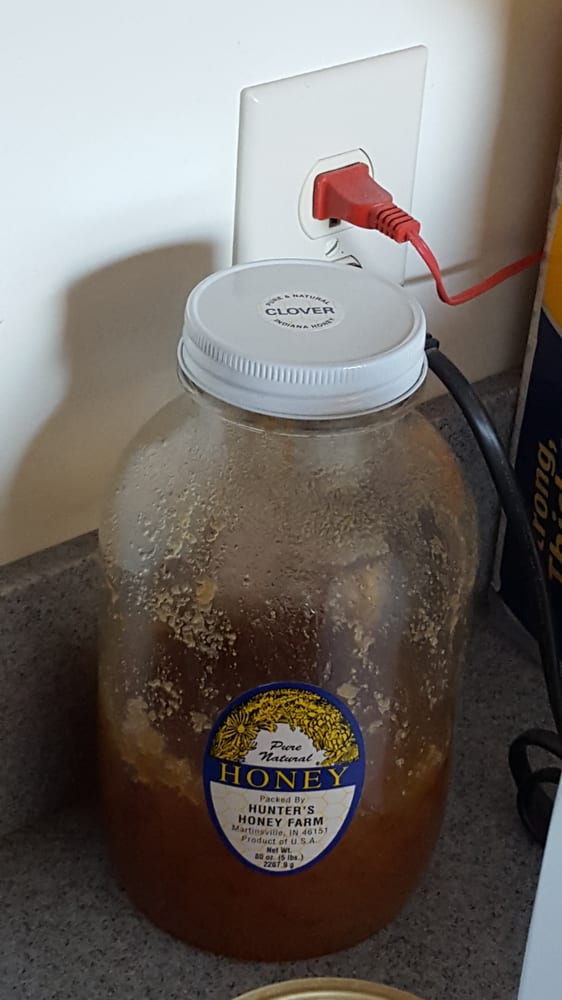
Locate an element on the screen. This screenshot has height=1000, width=562. red plug is located at coordinates (369, 205).